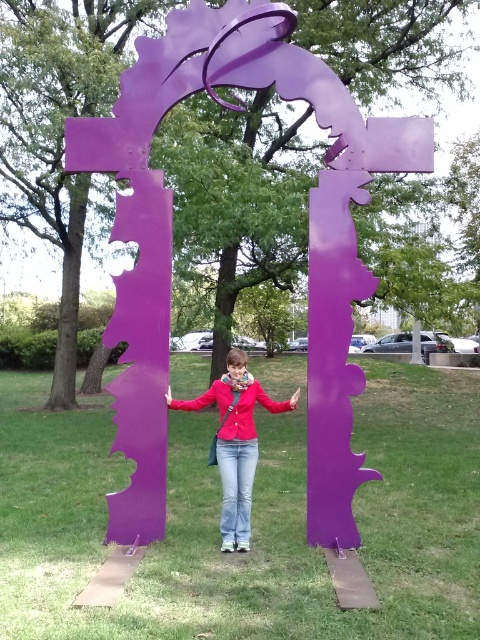
Question: Is purple matte arch at center above purple metallic sculpture at center?

Choices:
 (A) yes
 (B) no

Answer: (B)

Question: Based on their relative distances, which object is nearer to the purple metallic sculpture at center?

Choices:
 (A) matte purple scarf at center
 (B) purple matte arch at center

Answer: (A)

Question: Does purple metallic sculpture at center appear over matte purple scarf at center?

Choices:
 (A) no
 (B) yes

Answer: (B)

Question: Does purple matte arch at center have a greater width compared to purple metallic sculpture at center?

Choices:
 (A) no
 (B) yes

Answer: (B)

Question: Which object is positioned farthest from the matte purple scarf at center?

Choices:
 (A) purple metallic sculpture at center
 (B) purple matte arch at center

Answer: (B)

Question: Estimate the real-world distances between objects in this image. Which object is farther from the purple metallic sculpture at center?

Choices:
 (A) matte purple scarf at center
 (B) purple matte arch at center

Answer: (B)